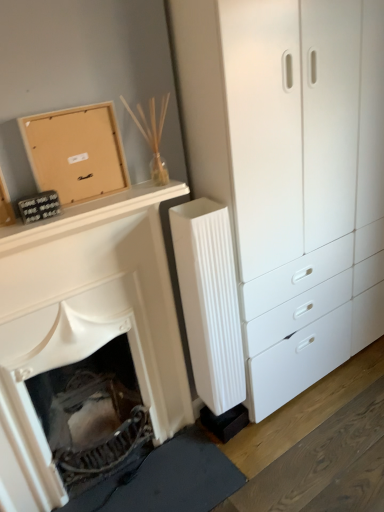
Question: Is matte brown cardboard at upper left facing towards white plastic chest of drawers at center-right?

Choices:
 (A) yes
 (B) no

Answer: (B)

Question: Is matte brown cardboard at upper left thinner than white plastic chest of drawers at center-right?

Choices:
 (A) no
 (B) yes

Answer: (B)

Question: Can you confirm if matte brown cardboard at upper left is bigger than white plastic chest of drawers at center-right?

Choices:
 (A) yes
 (B) no

Answer: (B)

Question: Is matte brown cardboard at upper left next to white plastic chest of drawers at center-right?

Choices:
 (A) yes
 (B) no

Answer: (B)

Question: From the image's perspective, does matte brown cardboard at upper left appear lower than white plastic chest of drawers at center-right?

Choices:
 (A) no
 (B) yes

Answer: (A)

Question: Is matte brown cardboard at upper left outside of white plastic chest of drawers at center-right?

Choices:
 (A) yes
 (B) no

Answer: (A)

Question: Is matte brown cardboard at upper left completely or partially outside of white ribbed radiator at center?

Choices:
 (A) yes
 (B) no

Answer: (A)

Question: Does matte brown cardboard at upper left lie behind white ribbed radiator at center?

Choices:
 (A) yes
 (B) no

Answer: (B)

Question: From the image's perspective, does matte brown cardboard at upper left appear higher than white ribbed radiator at center?

Choices:
 (A) yes
 (B) no

Answer: (A)

Question: From a real-world perspective, is matte brown cardboard at upper left positioned under white ribbed radiator at center based on gravity?

Choices:
 (A) yes
 (B) no

Answer: (B)

Question: Considering the relative sizes of matte brown cardboard at upper left and white ribbed radiator at center in the image provided, is matte brown cardboard at upper left taller than white ribbed radiator at center?

Choices:
 (A) yes
 (B) no

Answer: (B)

Question: Considering the relative positions of matte brown cardboard at upper left and white ribbed radiator at center in the image provided, is matte brown cardboard at upper left to the right of white ribbed radiator at center from the viewer's perspective?

Choices:
 (A) no
 (B) yes

Answer: (A)

Question: Considering the relative positions of white matte fireplace at lower left and matte brown cardboard at upper left in the image provided, is white matte fireplace at lower left to the left of matte brown cardboard at upper left from the viewer's perspective?

Choices:
 (A) no
 (B) yes

Answer: (B)